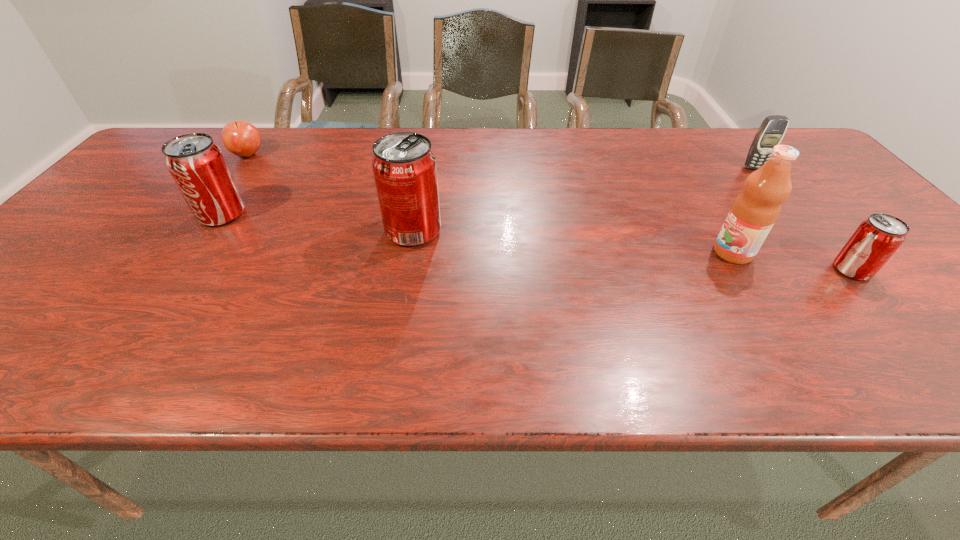
Please determine a free point for an extra pop_(soda) to ensure balance. Please provide its 2D coordinates. Your answer should be formatted as a tuple, i.e. [(x, y)], where the tuple contains the x and y coordinates of a point satisfying the conditions above.

[(622, 249)]